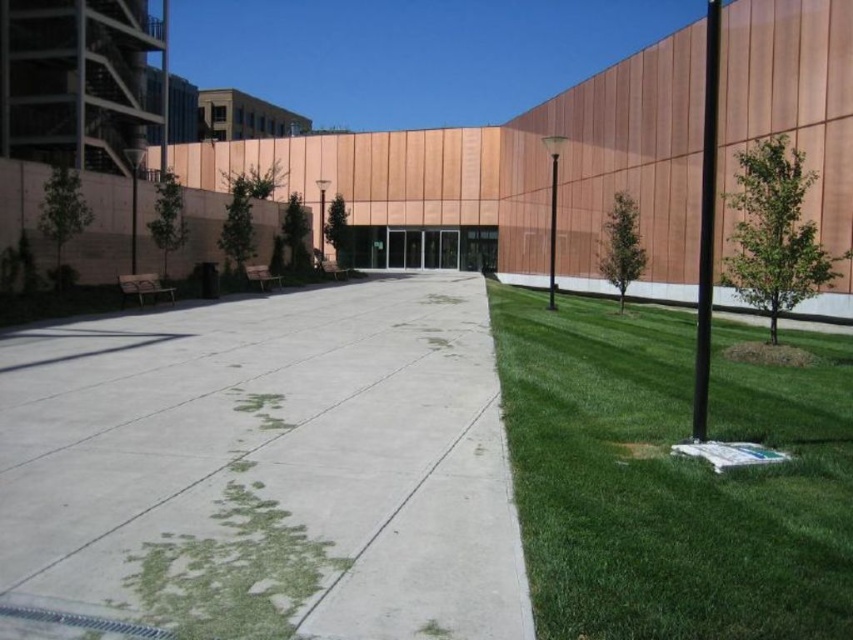
Can you confirm if white concrete pavement at center is wider than green grass at right?

Yes.

Is point (129, 397) positioned in front of point (622, 564)?

No, (129, 397) is further to viewer.

This screenshot has height=640, width=853. I want to click on white concrete pavement at center, so click(x=267, y=467).